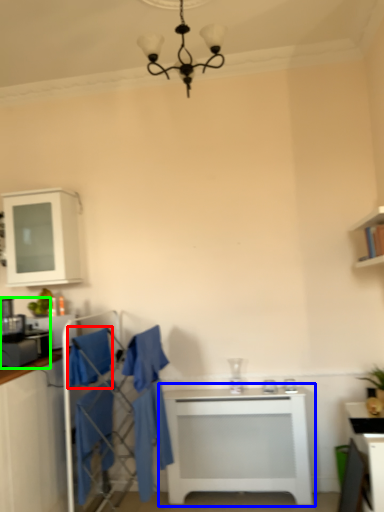
Question: Which object is the farthest from robe (highlighted by a red box)? Choose among these: table (highlighted by a blue box) or appliance (highlighted by a green box).

Choices:
 (A) table
 (B) appliance

Answer: (A)